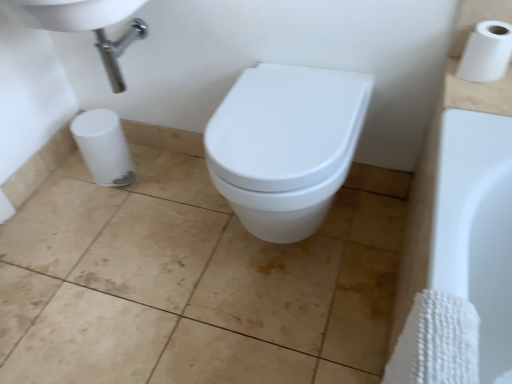
Question: Choose the correct answer: Is beige ceramic tile at center inside white matte toilet paper at upper right or outside it?

Choices:
 (A) outside
 (B) inside

Answer: (A)

Question: From a real-world perspective, is beige ceramic tile at center physically located above or below white matte toilet paper at upper right?

Choices:
 (A) above
 (B) below

Answer: (B)

Question: Which object is positioned farthest from the white glossy sink at upper left?

Choices:
 (A) white matte toilet paper at upper right
 (B) white glossy toilet at center
 (C) beige ceramic tile at center

Answer: (A)

Question: Which object is the farthest from the white glossy toilet at center?

Choices:
 (A) beige ceramic tile at center
 (B) white matte toilet paper at upper right
 (C) white glossy sink at upper left

Answer: (C)